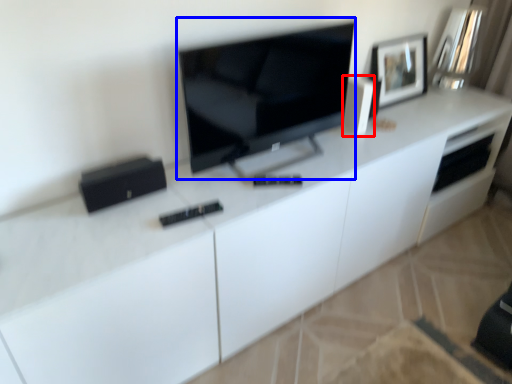
Question: Which object appears closest to the camera in this image, appliance (highlighted by a red box) or television (highlighted by a blue box)?

Choices:
 (A) appliance
 (B) television

Answer: (B)